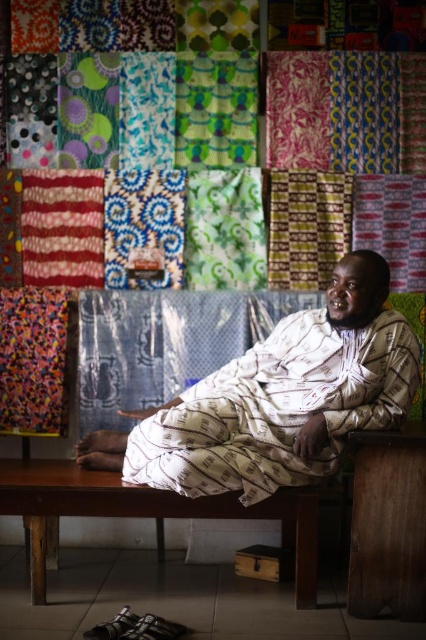
Question: Which object appears farthest from the camera in this image?

Choices:
 (A) brown wooden bench at lower center
 (B) white printed fabric at center
 (C) matte blue fabric at center

Answer: (C)

Question: Is white printed fabric at center smaller than matte blue fabric at center?

Choices:
 (A) no
 (B) yes

Answer: (A)

Question: Is white printed fabric at center further to camera compared to brown wooden bench at lower center?

Choices:
 (A) yes
 (B) no

Answer: (B)

Question: Is matte blue fabric at center positioned at the back of brown wooden bench at lower center?

Choices:
 (A) yes
 (B) no

Answer: (A)

Question: Based on their relative distances, which object is farther from the matte blue fabric at center?

Choices:
 (A) white printed fabric at center
 (B) brown wooden bench at lower center

Answer: (B)

Question: Among these objects, which one is nearest to the camera?

Choices:
 (A) matte blue fabric at center
 (B) brown wooden bench at lower center
 (C) white printed fabric at center

Answer: (C)